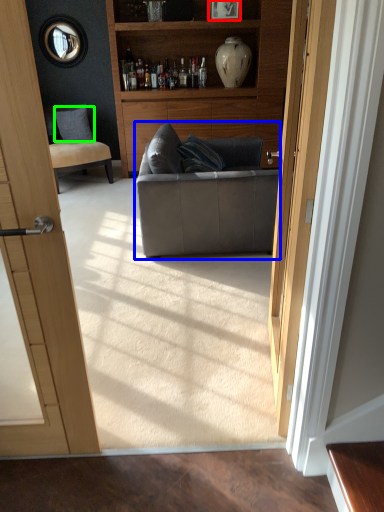
Question: Considering the real-world distances, which object is farthest from picture frame (highlighted by a red box)? studio couch (highlighted by a blue box) or pillow (highlighted by a green box)?

Choices:
 (A) studio couch
 (B) pillow

Answer: (A)